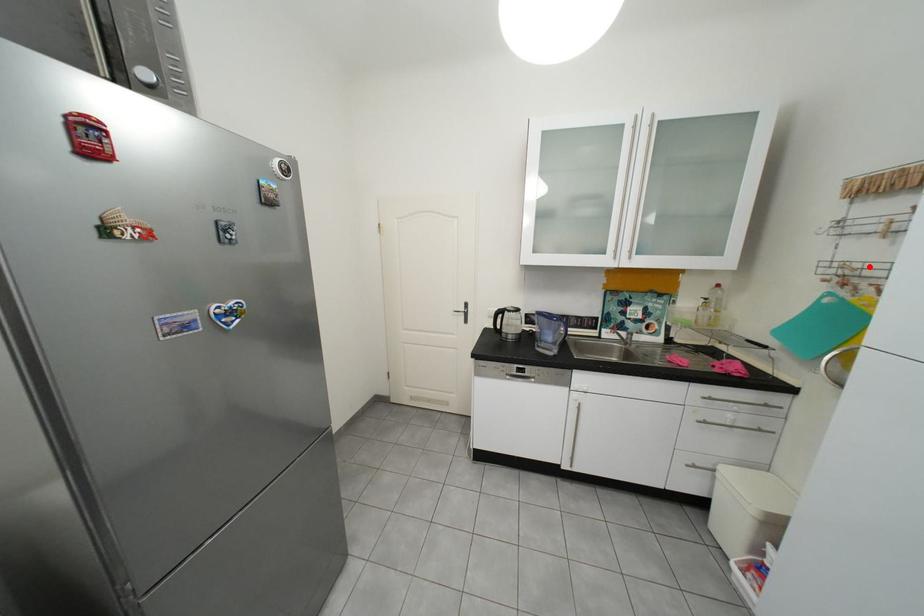
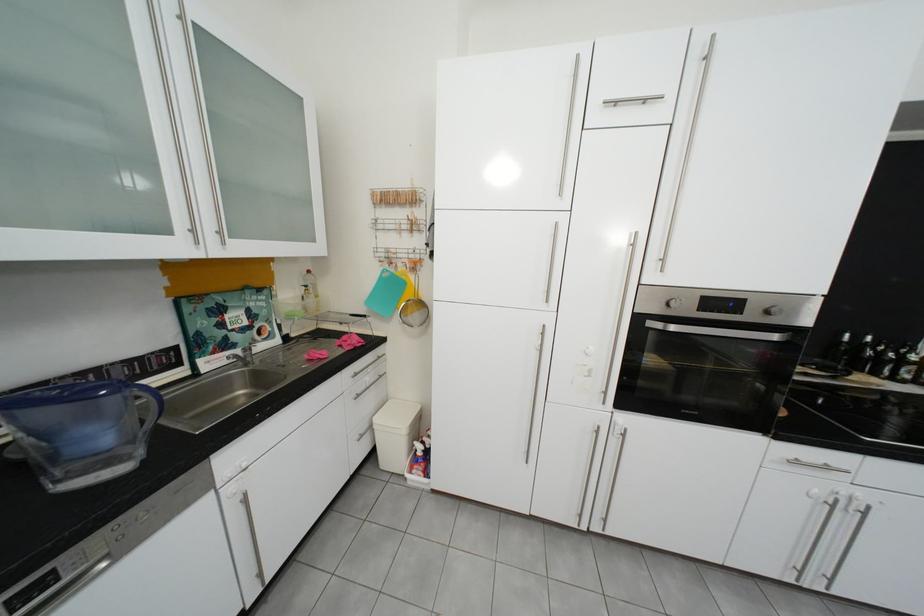
Question: I am providing you with two images of the same scene from different viewpoints. Given a red point in image1, look at the same physical point in image2. Is it:

Choices:
 (A) Closer to the viewpoint
 (B) Farther from the viewpoint

Answer: (A)